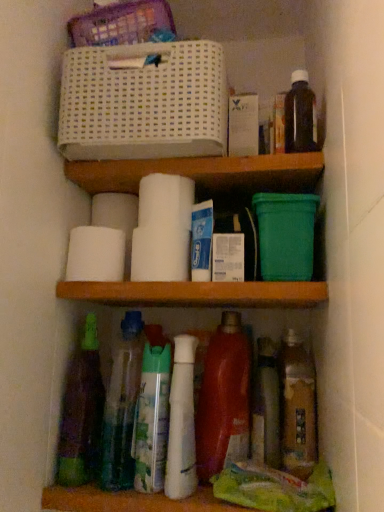
Question: Considering the relative positions of white matte toilet paper at center, the second toilet paper viewed from the front, and white matte toilet paper at center, which is the 1th toilet paper in front-to-back order, in the image provided, is white matte toilet paper at center, the second toilet paper viewed from the front, to the right of white matte toilet paper at center, which is the 1th toilet paper in front-to-back order, from the viewer's perspective?

Choices:
 (A) no
 (B) yes

Answer: (A)

Question: Considering the relative sizes of white matte toilet paper at center, the 3th toilet paper viewed from the back, and white matte toilet paper at center, which is counted as the fourth toilet paper, starting from the back, in the image provided, is white matte toilet paper at center, the 3th toilet paper viewed from the back, thinner than white matte toilet paper at center, which is counted as the fourth toilet paper, starting from the back,?

Choices:
 (A) yes
 (B) no

Answer: (B)

Question: Are white matte toilet paper at center, the second toilet paper viewed from the front, and white matte toilet paper at center, which is the 1th toilet paper in front-to-back order, located far from each other?

Choices:
 (A) yes
 (B) no

Answer: (B)

Question: Could you tell me if white matte toilet paper at center, the 3th toilet paper viewed from the back, is turned towards white matte toilet paper at center, which is counted as the fourth toilet paper, starting from the back?

Choices:
 (A) yes
 (B) no

Answer: (B)

Question: Is white matte toilet paper at center, the second toilet paper viewed from the front, positioned behind white matte toilet paper at center, which is the 1th toilet paper in front-to-back order?

Choices:
 (A) yes
 (B) no

Answer: (A)

Question: From the image's perspective, is white matte toilet paper at center, the 3th toilet paper viewed from the back, on top of white matte toilet paper at center, which is counted as the fourth toilet paper, starting from the back?

Choices:
 (A) yes
 (B) no

Answer: (B)

Question: Is white matte tube at center turned away from translucent plastic bottles at center, marked as the seventh bottle in a right-to-left arrangement?

Choices:
 (A) yes
 (B) no

Answer: (B)

Question: From a real-world perspective, does white matte tube at center stand above translucent plastic bottles at center, marked as the seventh bottle in a right-to-left arrangement?

Choices:
 (A) no
 (B) yes

Answer: (B)

Question: Can you confirm if white matte tube at center is shorter than translucent plastic bottles at center, the second bottle when ordered from left to right?

Choices:
 (A) yes
 (B) no

Answer: (A)

Question: From the image's perspective, would you say white matte tube at center is shown under translucent plastic bottles at center, the second bottle when ordered from left to right?

Choices:
 (A) yes
 (B) no

Answer: (B)

Question: Considering the relative positions of white matte tube at center and translucent plastic bottles at center, marked as the seventh bottle in a right-to-left arrangement, in the image provided, is white matte tube at center behind translucent plastic bottles at center, marked as the seventh bottle in a right-to-left arrangement,?

Choices:
 (A) yes
 (B) no

Answer: (A)

Question: Can you confirm if white matte tube at center is bigger than translucent plastic bottles at center, the second bottle when ordered from left to right?

Choices:
 (A) no
 (B) yes

Answer: (A)

Question: Considering the relative sizes of white matte toilet paper at center, the second toilet paper viewed from the front, and translucent plastic bottles at center, the second bottle when ordered from left to right, in the image provided, is white matte toilet paper at center, the second toilet paper viewed from the front, smaller than translucent plastic bottles at center, the second bottle when ordered from left to right,?

Choices:
 (A) yes
 (B) no

Answer: (A)